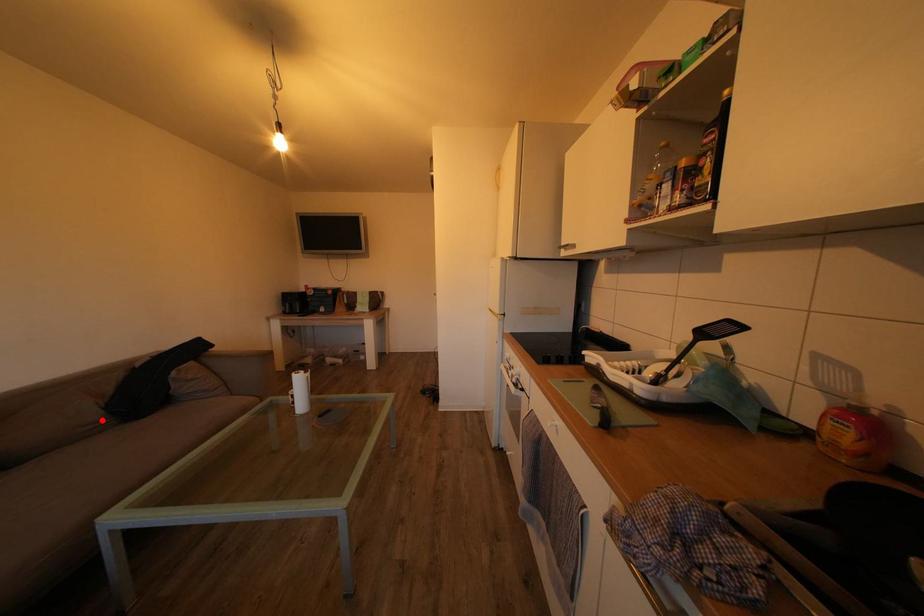
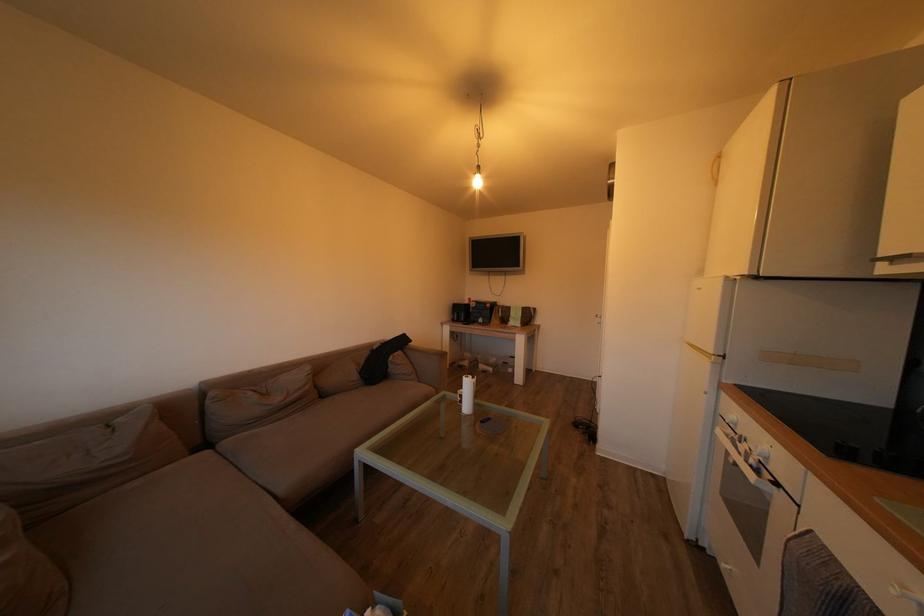
Question: A red point is marked in image1. In image2, is the corresponding 3D point closer to the camera or farther? Reply with the corresponding letter.

Choices:
 (A) The corresponding 3D point is closer.
 (B) The corresponding 3D point is farther.

Answer: (B)